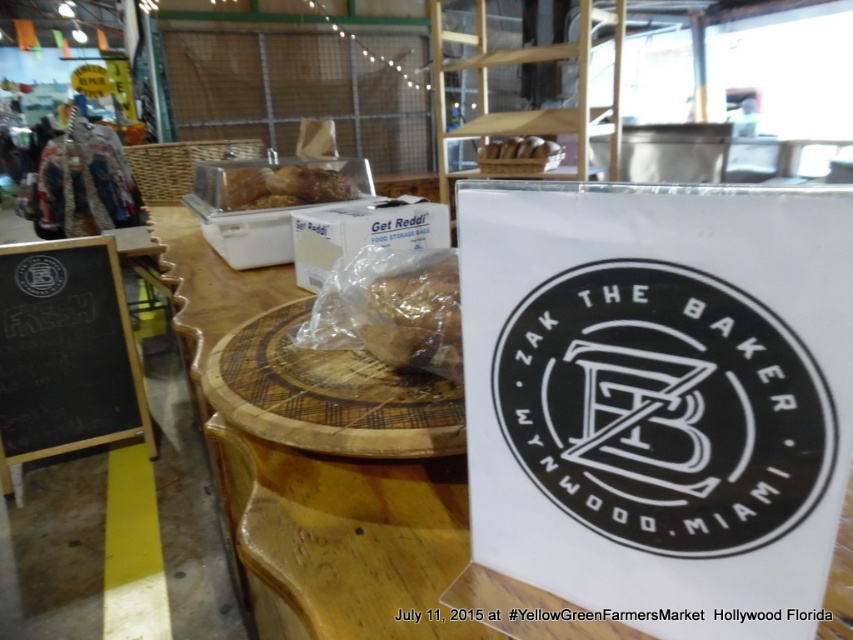
Is black chalkboard at left bigger than brown paper bag at upper center?

Yes, black chalkboard at left is bigger than brown paper bag at upper center.

Is point (67, 397) closer to viewer compared to point (512, 150)?

Yes, point (67, 397) is in front of point (512, 150).

This screenshot has height=640, width=853. What do you see at coordinates (65, 353) in the screenshot? I see `black chalkboard at left` at bounding box center [65, 353].

Find the location of a particular element. The height and width of the screenshot is (640, 853). black chalkboard at left is located at coordinates (65, 353).

Who is shorter, translucent plastic bread at center or black matte logo at center?

black matte logo at center is shorter.

Between translucent plastic bread at center and black matte logo at center, which one appears on the right side from the viewer's perspective?

translucent plastic bread at center

The height and width of the screenshot is (640, 853). What are the coordinates of `translucent plastic bread at center` in the screenshot? It's located at (283, 186).

This screenshot has width=853, height=640. Find the location of `translucent plastic bread at center`. translucent plastic bread at center is located at coordinates (283, 186).

Who is higher up, translucent plastic bread at center or brown paper bag at upper center?

brown paper bag at upper center is higher up.

Is translucent plastic bread at center in front of brown paper bag at upper center?

Yes, translucent plastic bread at center is in front of brown paper bag at upper center.

Where is `translucent plastic bread at center`? translucent plastic bread at center is located at coordinates (283, 186).